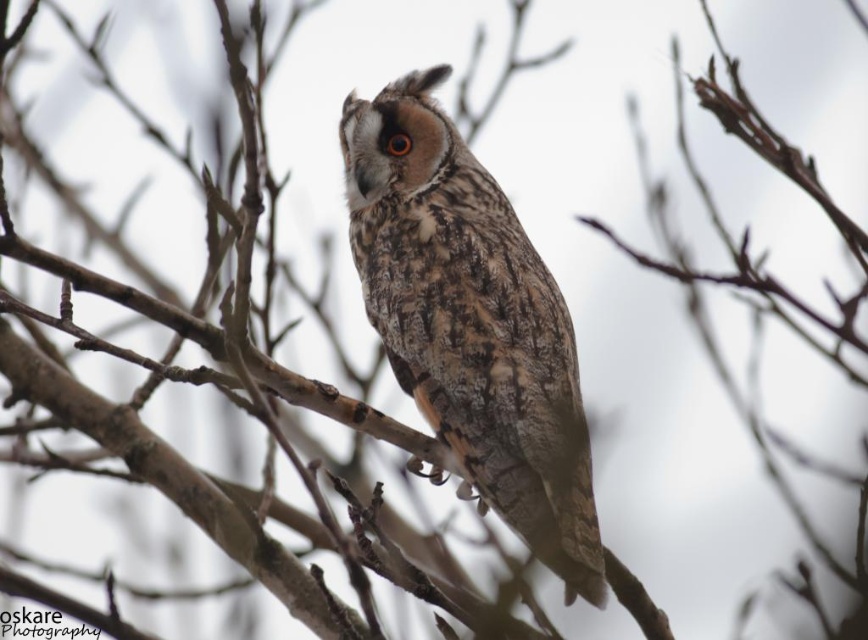
Question: Does camouflage feathered owl at center come in front of brown textured eye at center?

Choices:
 (A) no
 (B) yes

Answer: (B)

Question: Which of the following is the farthest from the observer?

Choices:
 (A) brown textured eye at center
 (B) camouflage feathered owl at center

Answer: (A)

Question: Can you confirm if camouflage feathered owl at center is positioned to the left of brown textured eye at center?

Choices:
 (A) yes
 (B) no

Answer: (B)

Question: Can you confirm if camouflage feathered owl at center is positioned above brown textured eye at center?

Choices:
 (A) no
 (B) yes

Answer: (A)